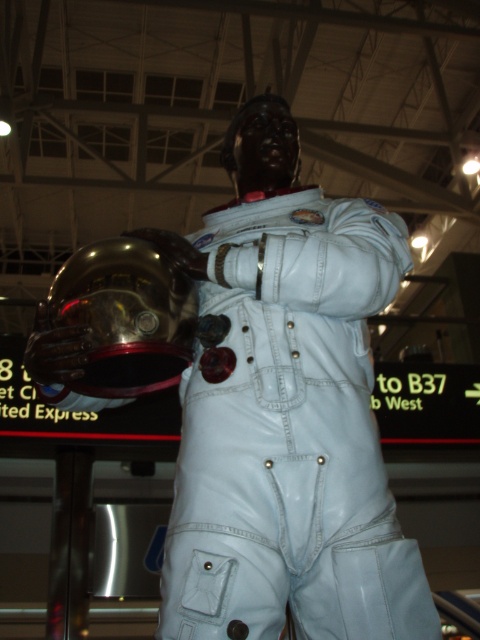
Question: Is white glossy astronaut at center above glossy metallic helmet at center?

Choices:
 (A) no
 (B) yes

Answer: (B)

Question: Does white glossy astronaut at center have a larger size compared to glossy metallic helmet at center?

Choices:
 (A) no
 (B) yes

Answer: (B)

Question: Which object appears farthest from the camera in this image?

Choices:
 (A) glossy metallic helmet at center
 (B) white glossy astronaut at center

Answer: (A)

Question: Does white glossy astronaut at center appear on the left side of glossy metallic helmet at center?

Choices:
 (A) yes
 (B) no

Answer: (B)